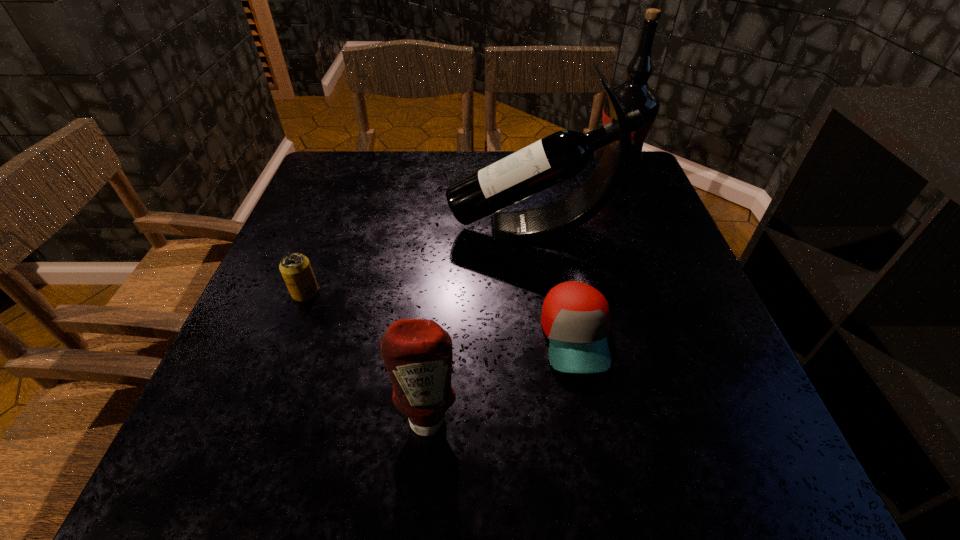
Where is `vacant space at the right edge of the desktop`? The width and height of the screenshot is (960, 540). vacant space at the right edge of the desktop is located at coordinates (638, 212).

At what (x,y) coordinates should I click in order to perform the action: click on vacant area at the far left corner of the desktop. Please return your answer as a coordinate pair (x, y). The width and height of the screenshot is (960, 540). Looking at the image, I should click on (355, 185).

Locate an element on the screen. vacant area at the far right corner of the desktop is located at coordinates (632, 187).

Find the location of a particular element. This screenshot has width=960, height=540. free space at the near right corner of the desktop is located at coordinates (713, 438).

Find the location of a particular element. This screenshot has height=540, width=960. free space between the nearer wine bottle and the baseball cap is located at coordinates (554, 283).

At what (x,y) coordinates should I click in order to perform the action: click on free space between the nearer wine bottle and the nearest object. Please return your answer as a coordinate pair (x, y). The width and height of the screenshot is (960, 540). Looking at the image, I should click on (480, 323).

Find the location of a particular element. This screenshot has height=540, width=960. vacant area between the farthest object and the shortest object is located at coordinates (596, 251).

Identify the location of vacant area between the farthest object and the beer can. (461, 229).

Where is `vacant area that lies between the second farthest object and the second shortest object`? This screenshot has height=540, width=960. vacant area that lies between the second farthest object and the second shortest object is located at coordinates pos(419,261).

The width and height of the screenshot is (960, 540). Find the location of `empty space that is in between the third shortest object and the beer can`. empty space that is in between the third shortest object and the beer can is located at coordinates click(x=367, y=355).